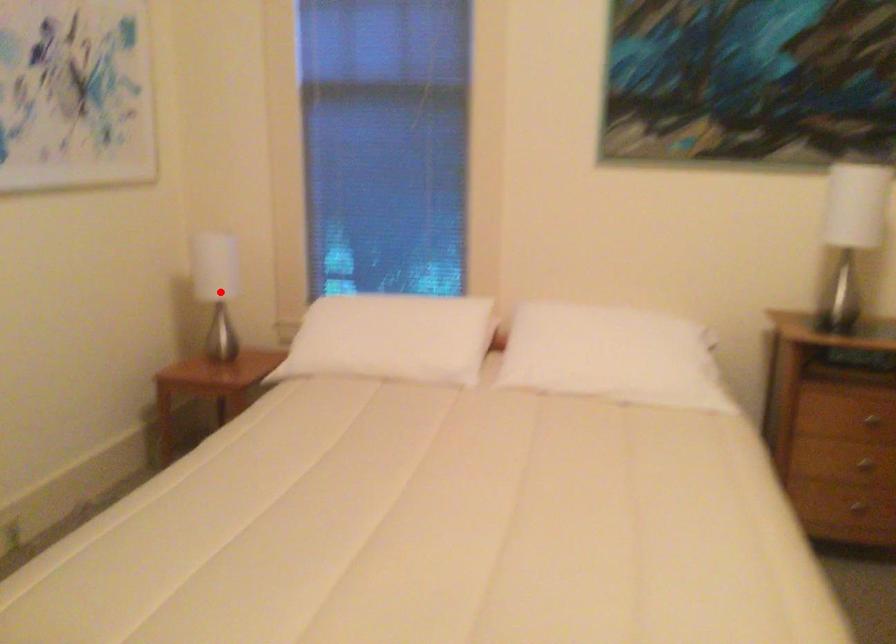
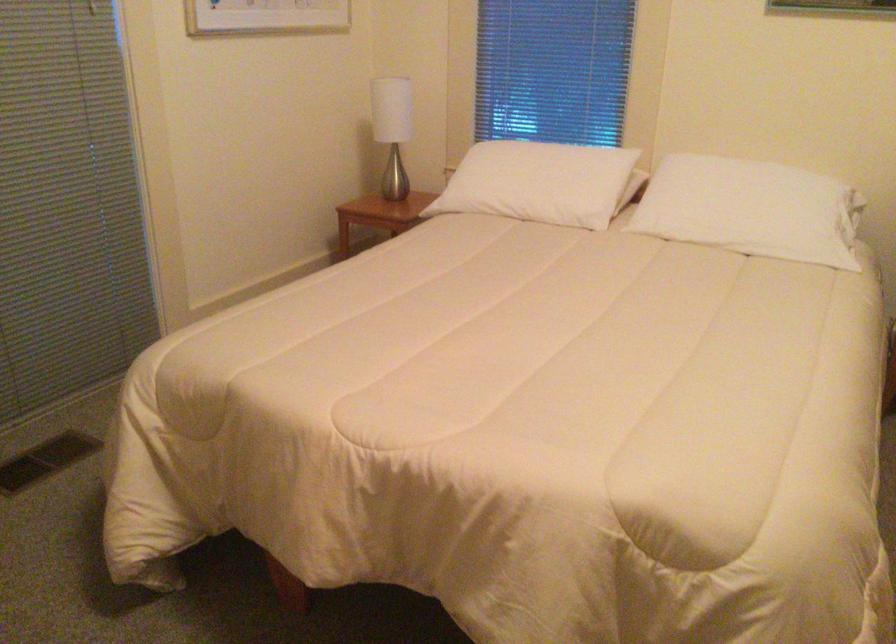
In the second image, find the point that corresponds to the highlighted location in the first image.

(392, 129)